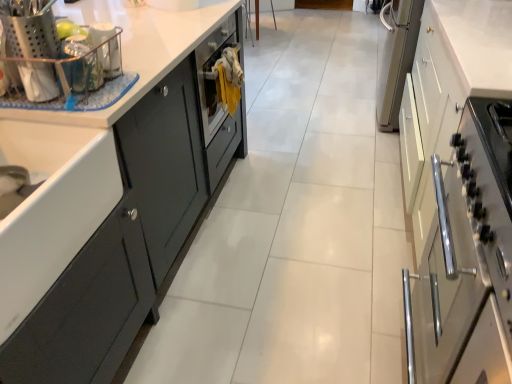
Image resolution: width=512 pixels, height=384 pixels. What do you see at coordinates (30, 28) in the screenshot?
I see `metallic silver utensil holder at upper left, which is the second appliance from right to left` at bounding box center [30, 28].

Describe the element at coordinates (136, 50) in the screenshot. I see `white glossy countertop at center` at that location.

Identify the location of matte dark gray cabinet at left, the 2th cabinetry positioned from the right. The image size is (512, 384). (104, 202).

This screenshot has height=384, width=512. I want to click on metallic wire basket at upper left, the second appliance positioned from the left, so click(106, 48).

Is matte dark gray cabinet at left, which ranks as the 1th cabinetry in left-to-right order, far away from metallic wire basket at upper left, which appears as the first appliance when viewed from the right?

No, matte dark gray cabinet at left, which ranks as the 1th cabinetry in left-to-right order, is in close proximity to metallic wire basket at upper left, which appears as the first appliance when viewed from the right.

From a real-world perspective, between matte dark gray cabinet at left, which ranks as the 1th cabinetry in left-to-right order, and metallic wire basket at upper left, which appears as the first appliance when viewed from the right, who is vertically lower?

matte dark gray cabinet at left, which ranks as the 1th cabinetry in left-to-right order, is physically lower.

Could you tell me if matte dark gray cabinet at left, which ranks as the 1th cabinetry in left-to-right order, is turned towards metallic wire basket at upper left, acting as the second appliance starting from the front?

No, matte dark gray cabinet at left, which ranks as the 1th cabinetry in left-to-right order, is not facing towards metallic wire basket at upper left, acting as the second appliance starting from the front.

Who is smaller, matte dark gray cabinet at left, which ranks as the 1th cabinetry in left-to-right order, or metallic wire basket at upper left, the second appliance positioned from the left?

metallic wire basket at upper left, the second appliance positioned from the left.

Is white glossy countertop at center completely or partially outside of matte dark gray cabinet at left, which ranks as the 1th cabinetry in left-to-right order?

Indeed, white glossy countertop at center is completely outside matte dark gray cabinet at left, which ranks as the 1th cabinetry in left-to-right order.

From their relative heights in the image, would you say white glossy countertop at center is taller or shorter than matte dark gray cabinet at left, which ranks as the 1th cabinetry in left-to-right order?

In the image, white glossy countertop at center appears to be taller than matte dark gray cabinet at left, which ranks as the 1th cabinetry in left-to-right order.

Can you tell me how much white glossy countertop at center and matte dark gray cabinet at left, the 2th cabinetry positioned from the right, differ in facing direction?

The facing directions of white glossy countertop at center and matte dark gray cabinet at left, the 2th cabinetry positioned from the right, are 1.28 degrees apart.

Is metallic wire basket at upper left, the second appliance positioned from the left, aimed at matte dark gray cabinet at left, the 2th cabinetry positioned from the right?

No, metallic wire basket at upper left, the second appliance positioned from the left, is not facing towards matte dark gray cabinet at left, the 2th cabinetry positioned from the right.

Locate an element on the screen. The image size is (512, 384). the 1st cabinetry to the right of the metallic wire basket at upper left, the second appliance positioned from the left, starting your count from the anchor is located at coordinates (104, 202).

From the image's perspective, between metallic wire basket at upper left, marked as the 1th appliance in a back-to-front arrangement, and matte dark gray cabinet at left, which ranks as the 1th cabinetry in left-to-right order, who is located below?

Answer: metallic wire basket at upper left, marked as the 1th appliance in a back-to-front arrangement, is shown below in the image.

Is satin white cabinet at right, which is the second cabinetry in left-to-right order, not close to metallic wire basket at upper left, marked as the 1th appliance in a back-to-front arrangement?

That's right, there is a large distance between satin white cabinet at right, which is the second cabinetry in left-to-right order, and metallic wire basket at upper left, marked as the 1th appliance in a back-to-front arrangement.

How much distance is there between satin white cabinet at right, which is the second cabinetry in left-to-right order, and metallic wire basket at upper left, the second appliance positioned from the left?

They are 1.14 meters apart.

Is satin white cabinet at right, which is the second cabinetry in left-to-right order, smaller than metallic wire basket at upper left, marked as the 1th appliance in a back-to-front arrangement?

No, satin white cabinet at right, which is the second cabinetry in left-to-right order, is not smaller than metallic wire basket at upper left, marked as the 1th appliance in a back-to-front arrangement.

Locate an element on the screen. cabinetry in front of the metallic wire basket at upper left, the second appliance positioned from the left is located at coordinates (460, 194).

How distant is metallic silver utensil holder at upper left, which is the second appliance from right to left, from satin white cabinet at right, which is the second cabinetry in left-to-right order?

A distance of 1.22 meters exists between metallic silver utensil holder at upper left, which is the second appliance from right to left, and satin white cabinet at right, which is the second cabinetry in left-to-right order.

Consider the image. Can you confirm if metallic silver utensil holder at upper left, which is the second appliance from right to left, is taller than satin white cabinet at right, which is the second cabinetry in left-to-right order?

No, metallic silver utensil holder at upper left, which is the second appliance from right to left, is not taller than satin white cabinet at right, which is the second cabinetry in left-to-right order.

From the image's perspective, is metallic silver utensil holder at upper left, which is the second appliance in back-to-front order, below satin white cabinet at right, the first cabinetry in the right-to-left sequence?

Actually, metallic silver utensil holder at upper left, which is the second appliance in back-to-front order, appears above satin white cabinet at right, the first cabinetry in the right-to-left sequence, in the image.

Choose the correct answer: Is metallic silver utensil holder at upper left, which is the 1th appliance in front-to-back order, inside satin white cabinet at right, the first cabinetry in the right-to-left sequence, or outside it?

metallic silver utensil holder at upper left, which is the 1th appliance in front-to-back order, is located beyond the bounds of satin white cabinet at right, the first cabinetry in the right-to-left sequence.

Based on their sizes in the image, would you say white glossy countertop at center is bigger or smaller than satin white cabinet at right, which is the second cabinetry in left-to-right order?

In the image, white glossy countertop at center appears to be smaller than satin white cabinet at right, which is the second cabinetry in left-to-right order.

You are a GUI agent. You are given a task and a screenshot of the screen. Output one action in this format:
    pyautogui.click(x=<x>, y=<y>)
    Task: Click on the countertop that is above the satin white cabinet at right, the first cabinetry in the right-to-left sequence (from the image's perspective)
    The width and height of the screenshot is (512, 384).
    Given the screenshot: What is the action you would take?
    pyautogui.click(x=136, y=50)

Measure the distance from white glossy countertop at center to satin white cabinet at right, which is the second cabinetry in left-to-right order.

They are 3.42 feet apart.

Does white glossy countertop at center turn towards satin white cabinet at right, the first cabinetry in the right-to-left sequence?

Yes, white glossy countertop at center is oriented towards satin white cabinet at right, the first cabinetry in the right-to-left sequence.

Which object is thinner, metallic wire basket at upper left, the second appliance positioned from the left, or metallic silver utensil holder at upper left, which is the 1th appliance in front-to-back order?

With smaller width is metallic wire basket at upper left, the second appliance positioned from the left.

Is there a large distance between metallic wire basket at upper left, which appears as the first appliance when viewed from the right, and metallic silver utensil holder at upper left, which is the second appliance from right to left?

metallic wire basket at upper left, which appears as the first appliance when viewed from the right, is near metallic silver utensil holder at upper left, which is the second appliance from right to left, not far away.

Considering the positions of objects metallic wire basket at upper left, marked as the 1th appliance in a back-to-front arrangement, and metallic silver utensil holder at upper left, which is counted as the 1th appliance, starting from the left, in the image provided, who is behind, metallic wire basket at upper left, marked as the 1th appliance in a back-to-front arrangement, or metallic silver utensil holder at upper left, which is counted as the 1th appliance, starting from the left,?

metallic wire basket at upper left, marked as the 1th appliance in a back-to-front arrangement, is more distant.

Can you confirm if metallic wire basket at upper left, the second appliance positioned from the left, is bigger than metallic silver utensil holder at upper left, which is counted as the 1th appliance, starting from the left?

Actually, metallic wire basket at upper left, the second appliance positioned from the left, might be smaller than metallic silver utensil holder at upper left, which is counted as the 1th appliance, starting from the left.

Find the location of a particular element. This screenshot has height=384, width=512. cabinetry behind the metallic wire basket at upper left, acting as the second appliance starting from the front is located at coordinates (104, 202).

At what (x,y) coordinates should I click in order to perform the action: click on countertop on the left of matte dark gray cabinet at left, the 2th cabinetry positioned from the right. Please return your answer as a coordinate pair (x, y). This screenshot has height=384, width=512. Looking at the image, I should click on (136, 50).

Looking at the image, which one is located closer to satin white cabinet at right, which is the second cabinetry in left-to-right order, metallic wire basket at upper left, marked as the 1th appliance in a back-to-front arrangement, or white glossy countertop at center?

white glossy countertop at center lies closer to satin white cabinet at right, which is the second cabinetry in left-to-right order, than the other object.

Estimate the real-world distances between objects in this image. Which object is further from metallic silver utensil holder at upper left, which is the 1th appliance in front-to-back order, matte dark gray cabinet at left, the 2th cabinetry positioned from the right, or metallic wire basket at upper left, marked as the 1th appliance in a back-to-front arrangement?

matte dark gray cabinet at left, the 2th cabinetry positioned from the right, is further to metallic silver utensil holder at upper left, which is the 1th appliance in front-to-back order.

From the image, which object appears to be nearer to white glossy countertop at center, matte dark gray cabinet at left, the 2th cabinetry positioned from the right, or satin white cabinet at right, which is the second cabinetry in left-to-right order?

Based on the image, matte dark gray cabinet at left, the 2th cabinetry positioned from the right, appears to be nearer to white glossy countertop at center.

Based on the photo, when comparing their distances from metallic wire basket at upper left, which appears as the first appliance when viewed from the right, does satin white cabinet at right, the first cabinetry in the right-to-left sequence, or metallic silver utensil holder at upper left, which is counted as the 1th appliance, starting from the left, seem further?

The object further to metallic wire basket at upper left, which appears as the first appliance when viewed from the right, is satin white cabinet at right, the first cabinetry in the right-to-left sequence.

Estimate the real-world distances between objects in this image. Which object is further from satin white cabinet at right, which is the second cabinetry in left-to-right order, metallic silver utensil holder at upper left, which is the 1th appliance in front-to-back order, or metallic wire basket at upper left, which appears as the first appliance when viewed from the right?

Based on the image, metallic silver utensil holder at upper left, which is the 1th appliance in front-to-back order, appears to be further to satin white cabinet at right, which is the second cabinetry in left-to-right order.

Which object lies further to the anchor point satin white cabinet at right, which is the second cabinetry in left-to-right order, metallic wire basket at upper left, acting as the second appliance starting from the front, or metallic silver utensil holder at upper left, which is the 1th appliance in front-to-back order?

Based on the image, metallic silver utensil holder at upper left, which is the 1th appliance in front-to-back order, appears to be further to satin white cabinet at right, which is the second cabinetry in left-to-right order.

When comparing their distances from matte dark gray cabinet at left, the 2th cabinetry positioned from the right, does metallic wire basket at upper left, acting as the second appliance starting from the front, or white glossy countertop at center seem further?

Based on the image, metallic wire basket at upper left, acting as the second appliance starting from the front, appears to be further to matte dark gray cabinet at left, the 2th cabinetry positioned from the right.

Which object lies further to the anchor point metallic silver utensil holder at upper left, which is counted as the 1th appliance, starting from the left, metallic wire basket at upper left, the second appliance positioned from the left, or satin white cabinet at right, the first cabinetry in the right-to-left sequence?

Among the two, satin white cabinet at right, the first cabinetry in the right-to-left sequence, is located further to metallic silver utensil holder at upper left, which is counted as the 1th appliance, starting from the left.

Locate an element on the screen. countertop between metallic wire basket at upper left, the second appliance positioned from the left, and matte dark gray cabinet at left, the 2th cabinetry positioned from the right, in the horizontal direction is located at coordinates [136, 50].

The height and width of the screenshot is (384, 512). In order to click on countertop between metallic silver utensil holder at upper left, which is the 1th appliance in front-to-back order, and satin white cabinet at right, the first cabinetry in the right-to-left sequence, in the horizontal direction in this screenshot , I will do `click(136, 50)`.

At what (x,y) coordinates should I click in order to perform the action: click on cabinetry between metallic silver utensil holder at upper left, which is counted as the 1th appliance, starting from the left, and satin white cabinet at right, which is the second cabinetry in left-to-right order. Please return your answer as a coordinate pair (x, y). This screenshot has width=512, height=384. Looking at the image, I should click on click(x=104, y=202).

Locate an element on the screen. Image resolution: width=512 pixels, height=384 pixels. appliance positioned between metallic silver utensil holder at upper left, which is the second appliance from right to left, and white glossy countertop at center from near to far is located at coordinates (106, 48).